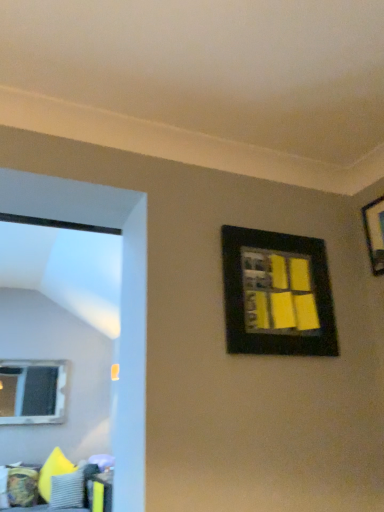
Question: Should I look upward or downward to see clear glass window at left?

Choices:
 (A) up
 (B) down

Answer: (B)

Question: From a real-world perspective, is black matte picture frame at upper right, acting as the 1th picture frame starting from the left, over black matte picture frame at upper right, the first picture frame in the right-to-left sequence?

Choices:
 (A) no
 (B) yes

Answer: (A)

Question: Considering the relative sizes of black matte picture frame at upper right, the 2th picture frame when ordered from right to left, and black matte picture frame at upper right, the first picture frame in the right-to-left sequence, in the image provided, is black matte picture frame at upper right, the 2th picture frame when ordered from right to left, thinner than black matte picture frame at upper right, the first picture frame in the right-to-left sequence,?

Choices:
 (A) no
 (B) yes

Answer: (A)

Question: Considering the relative positions of black matte picture frame at upper right, acting as the 1th picture frame starting from the left, and black matte picture frame at upper right, which is the 2th picture frame from left to right, in the image provided, is black matte picture frame at upper right, acting as the 1th picture frame starting from the left, behind black matte picture frame at upper right, which is the 2th picture frame from left to right,?

Choices:
 (A) yes
 (B) no

Answer: (B)

Question: Can you confirm if black matte picture frame at upper right, acting as the 1th picture frame starting from the left, is shorter than black matte picture frame at upper right, which is the 2th picture frame from left to right?

Choices:
 (A) no
 (B) yes

Answer: (A)

Question: From the image's perspective, is black matte picture frame at upper right, the 2th picture frame when ordered from right to left, on black matte picture frame at upper right, the first picture frame in the right-to-left sequence?

Choices:
 (A) yes
 (B) no

Answer: (B)

Question: Does black matte picture frame at upper right, acting as the 1th picture frame starting from the left, appear on the left side of black matte picture frame at upper right, the first picture frame in the right-to-left sequence?

Choices:
 (A) yes
 (B) no

Answer: (A)

Question: Does black matte picture frame at upper right, which is the 2th picture frame from left to right, have a larger size compared to textured fabric couch at lower left?

Choices:
 (A) yes
 (B) no

Answer: (B)

Question: Can you confirm if black matte picture frame at upper right, which is the 2th picture frame from left to right, is taller than textured fabric couch at lower left?

Choices:
 (A) yes
 (B) no

Answer: (B)

Question: Is black matte picture frame at upper right, which is the 2th picture frame from left to right, beside textured fabric couch at lower left?

Choices:
 (A) yes
 (B) no

Answer: (B)

Question: From the image's perspective, is black matte picture frame at upper right, which is the 2th picture frame from left to right, on top of textured fabric couch at lower left?

Choices:
 (A) no
 (B) yes

Answer: (B)

Question: Is black matte picture frame at upper right, which is the 2th picture frame from left to right, facing away from textured fabric couch at lower left?

Choices:
 (A) yes
 (B) no

Answer: (B)

Question: Can textured fabric couch at lower left be found inside black matte picture frame at upper right, the first picture frame in the right-to-left sequence?

Choices:
 (A) no
 (B) yes

Answer: (A)

Question: Could you tell me if gray textured pillow at lower left is turned towards black matte picture frame at upper right, which is the 2th picture frame from left to right?

Choices:
 (A) no
 (B) yes

Answer: (A)